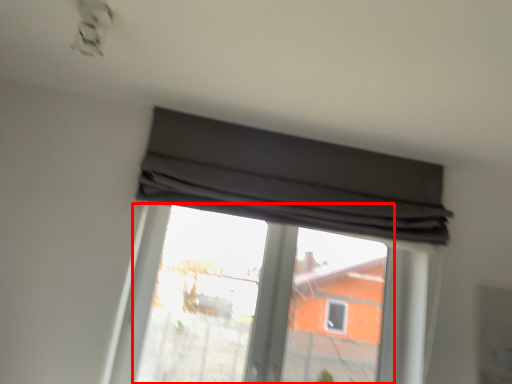
Question: Considering the relative positions of bay window (annotated by the red box) and window in the image provided, where is bay window (annotated by the red box) located with respect to the staircase?

Choices:
 (A) right
 (B) left

Answer: (B)